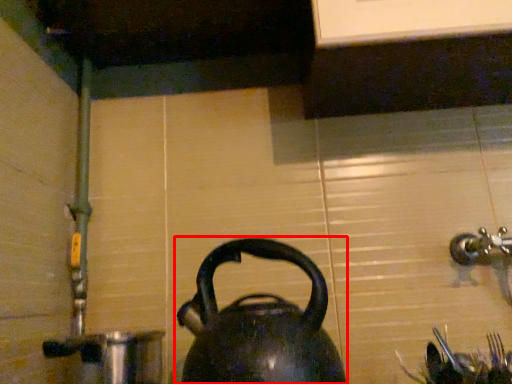
Question: From the image's perspective, where is kettle (annotated by the red box) located in relation to coffeepot in the image?

Choices:
 (A) below
 (B) above

Answer: (B)